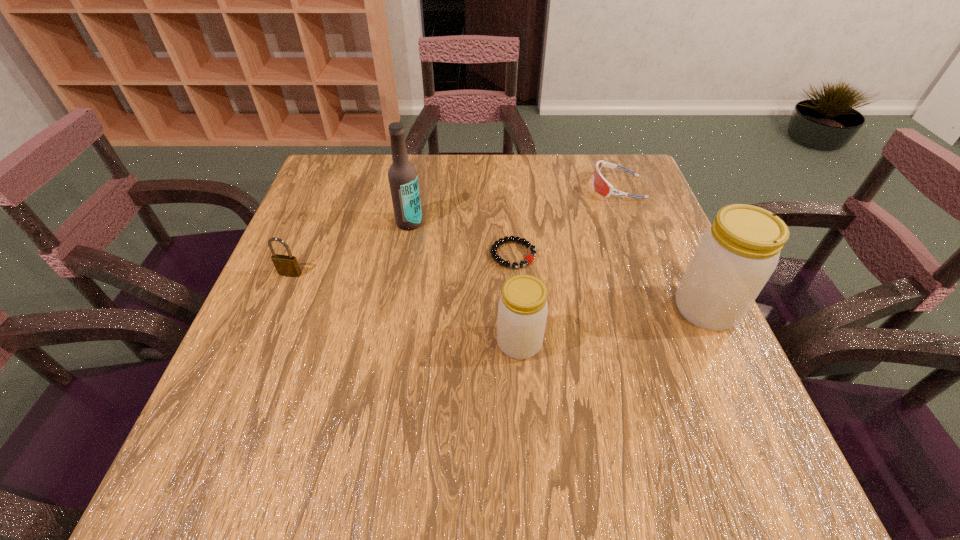
The image size is (960, 540). I want to click on the third tallest object, so click(x=522, y=310).

Locate an element on the screen. This screenshot has height=540, width=960. the left jar is located at coordinates (522, 310).

You are a GUI agent. You are given a task and a screenshot of the screen. Output one action in this format:
    pyautogui.click(x=<x>, y=<y>)
    Task: Click on the right jar
    The width and height of the screenshot is (960, 540).
    Given the screenshot: What is the action you would take?
    tap(734, 258)

The width and height of the screenshot is (960, 540). I want to click on the taller jar, so click(734, 258).

Identify the location of goggles. This screenshot has height=540, width=960. (600, 184).

Locate an element on the screen. the farthest object is located at coordinates (600, 184).

In order to click on the fifth nearest object in this screenshot , I will do `click(402, 175)`.

Where is `the second object from left to right`? The height and width of the screenshot is (540, 960). the second object from left to right is located at coordinates (402, 175).

You are a GUI agent. You are given a task and a screenshot of the screen. Output one action in this format:
    pyautogui.click(x=<x>, y=<y>)
    Task: Click on the fourth tallest object
    
    Given the screenshot: What is the action you would take?
    pyautogui.click(x=285, y=265)

At what (x,y) coordinates should I click in order to perform the action: click on padlock. Please return your answer as a coordinate pair (x, y). Looking at the image, I should click on (285, 265).